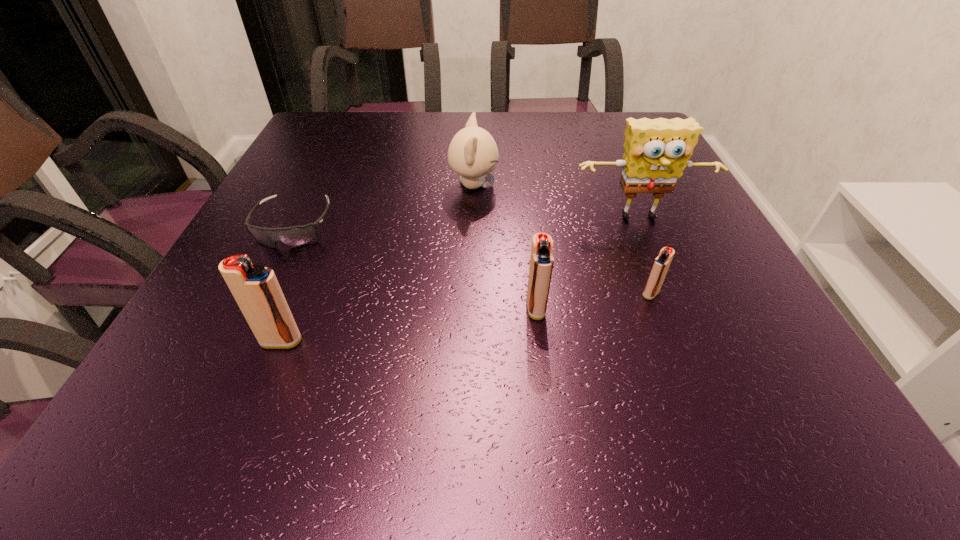
Where is `location for an additional igniter to make spacing equal`? The image size is (960, 540). location for an additional igniter to make spacing equal is located at coordinates [413, 325].